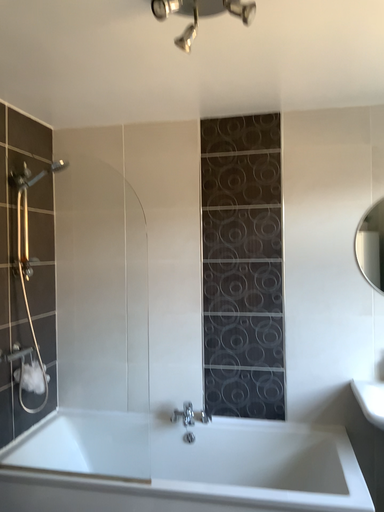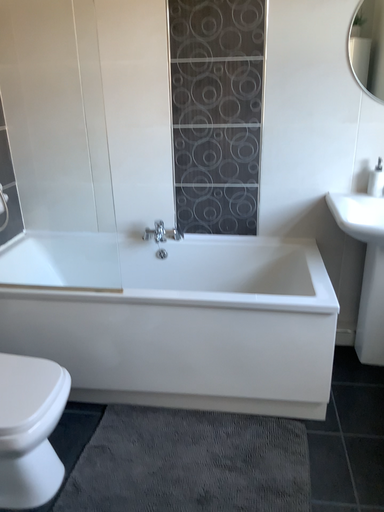
Question: Which way did the camera rotate in the video?

Choices:
 (A) rotated upward
 (B) rotated downward

Answer: (B)